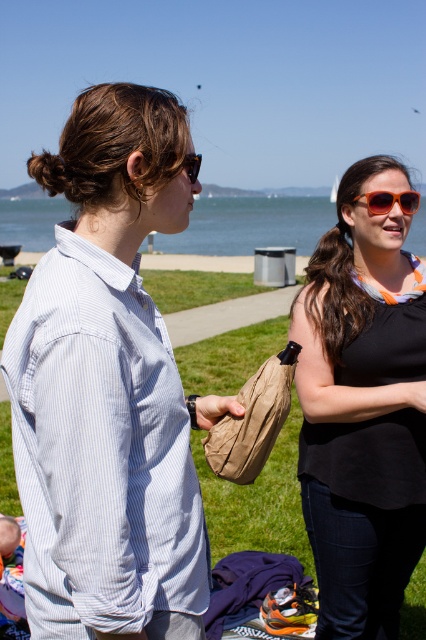
Is green grass at center wider than clear blue water at upper center?

No, green grass at center is not wider than clear blue water at upper center.

Which is behind, point (3, 332) or point (230, 202)?

The point (230, 202) is more distant.

Which is behind, point (307, 547) or point (215, 228)?

The point (215, 228) is behind.

This screenshot has width=426, height=640. I want to click on green grass at center, so click(258, 500).

Can you confirm if matte black tank top at center is bigger than orange plastic sunglasses at center?

Yes, matte black tank top at center is bigger than orange plastic sunglasses at center.

Measure the distance between matte black tank top at center and camera.

The distance of matte black tank top at center from camera is 2.44 meters.

Image resolution: width=426 pixels, height=640 pixels. What are the coordinates of `matte black tank top at center` in the screenshot? It's located at (362, 410).

Locate an element on the screen. matte black tank top at center is located at coordinates (362, 410).

Who is positioned more to the right, green grass at center or orange plastic sunglasses at center?

Positioned to the right is orange plastic sunglasses at center.

Which of these two, green grass at center or orange plastic sunglasses at center, stands taller?

green grass at center is taller.

Find the location of a particular element. The height and width of the screenshot is (640, 426). green grass at center is located at coordinates point(258,500).